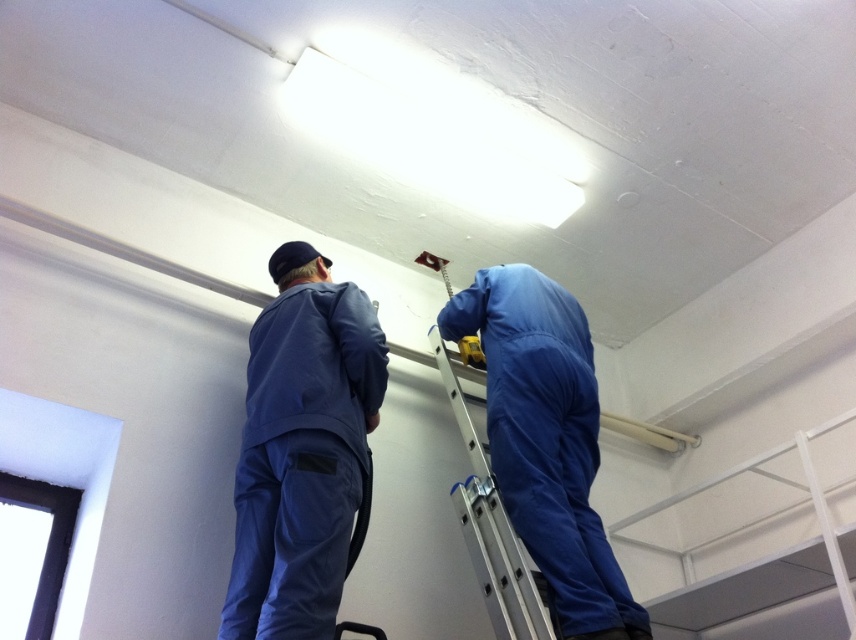
You are a safety inspector checking the workspace. You notice the blue matte jumpsuit at upper center and the silver metallic ladder at upper center. Based on their positions, which object is more likely to be blocking the emergency exit sign located above the ladder?

The blue matte jumpsuit at upper center might be wider than the silver metallic ladder at upper center, so it is more likely blocking the emergency exit sign located above the ladder.

You are a contractor planning to install a new light fixture in the room. The existing light fixture is at the center of the ceiling. There is a point marked at coordinates [301,449] which corresponds to the blue fabric jumpsuit at center. Can you determine if the existing light fixture is closer to the blue fabric jumpsuit at center or the window on the left side of the frame?

The point marked at coordinates [301,449] corresponds to the blue fabric jumpsuit at center. Since the existing light fixture is at the center of the ceiling, it is directly above the blue fabric jumpsuit at center, making them equidistant vertically. However, horizontally, the window is on the left side of the frame, so the light fixture is closer to the blue fabric jumpsuit at center than the window.

You are standing in the room and want to reach a point marked at coordinates (551,312). You have a 6.56 feet long pole. Can you reach that point with the pole?

The point at coordinates (551,312) is 7.62 feet away from the camera. Since the pole is only 6.56 feet long, it is not long enough to reach the point.